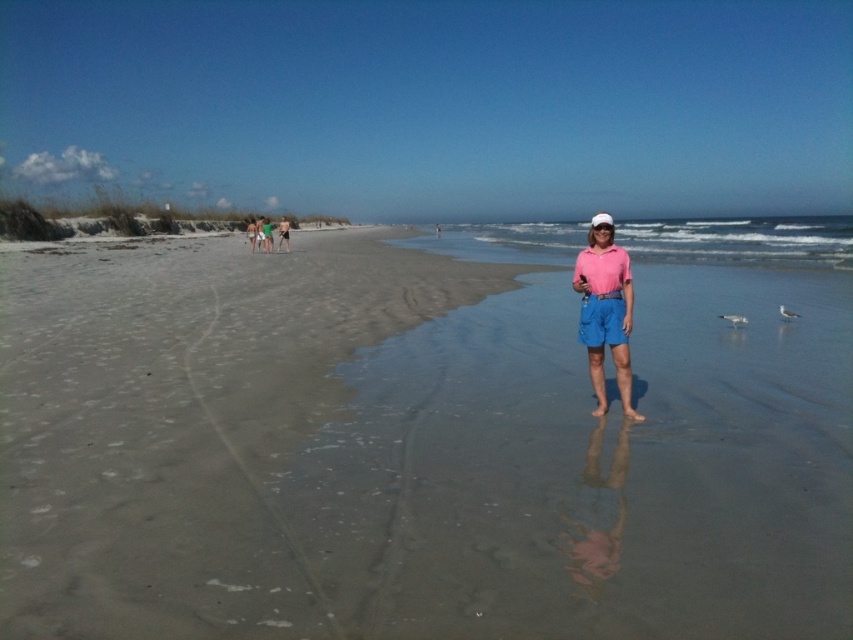
You are a photographer trying to capture a reflection of the tan skin at center in the blue water at center. Based on the scene, will the reflection be clear or faint?

The reflection of the tan skin at center in the blue water at center will be faint because the blue water at center is larger in size than tan skin at center.

You are standing on the beach and see the sandy beach at center and the tan skin at center. Which object is located to the right of the other?

The sandy beach at center is to the right of the tan skin at center.

You are standing at the point marked as point (422,442) and want to walk towards the sandy beach at center. Which direction should you go?

You are already at the sandy beach at center, which is located at point (422,442), so you don not need to move in any direction.